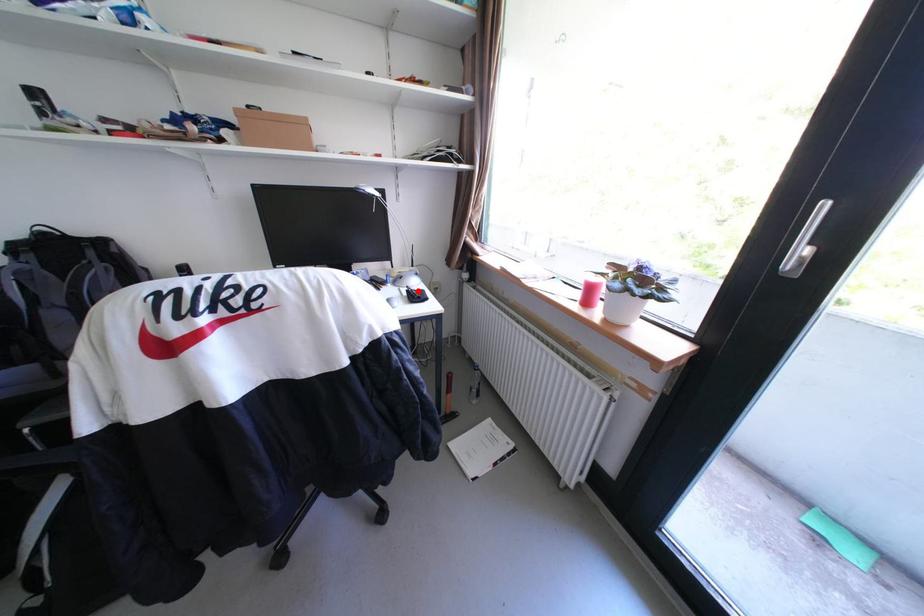
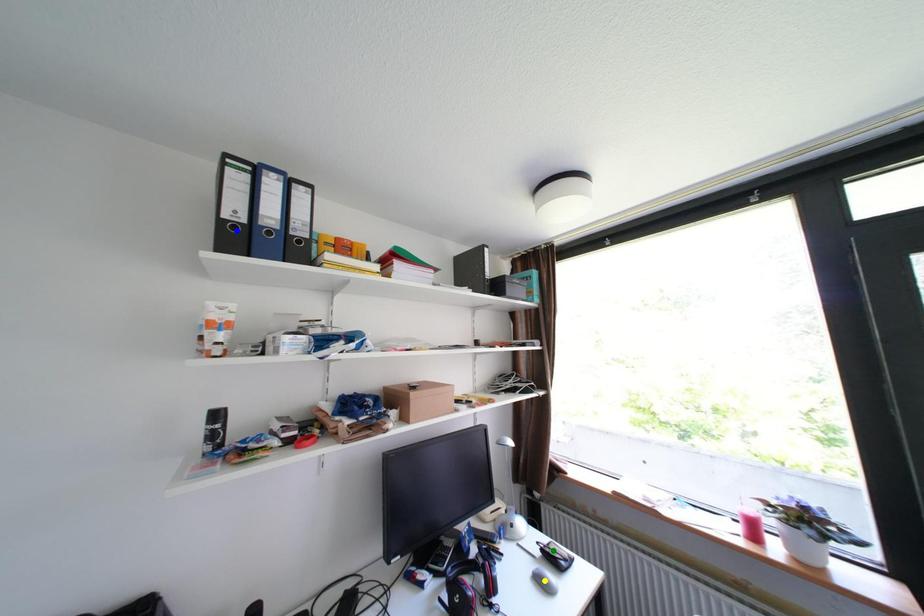
Question: I am providing you with two images of the same scene from different viewpoints. A red point is marked on the first image. You are given multiple points on the second image. Which point in image 2 is actually the same real-world point as the red point in image 1?

Choices:
 (A) green point
 (B) blue point
 (C) yellow point

Answer: (A)